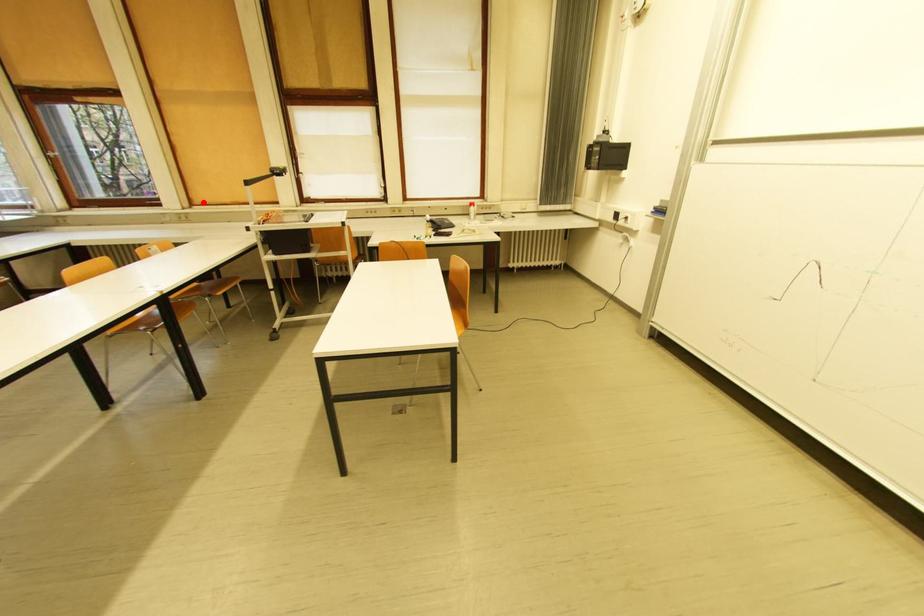
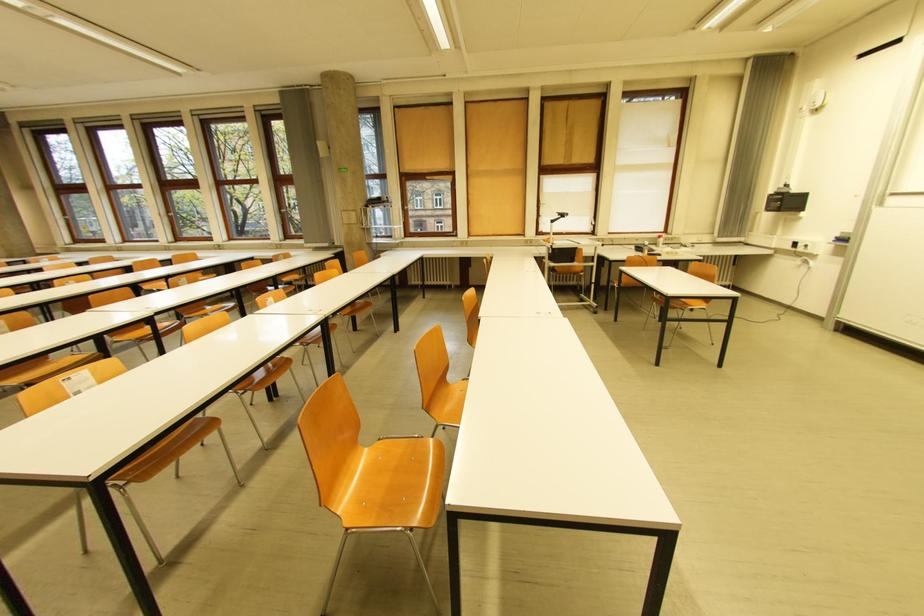
Question: I am providing you with two images of the same scene from different viewpoints. A red point is marked on the first image. Is the red point's position out of view in image 2?

Choices:
 (A) Yes
 (B) No

Answer: (B)